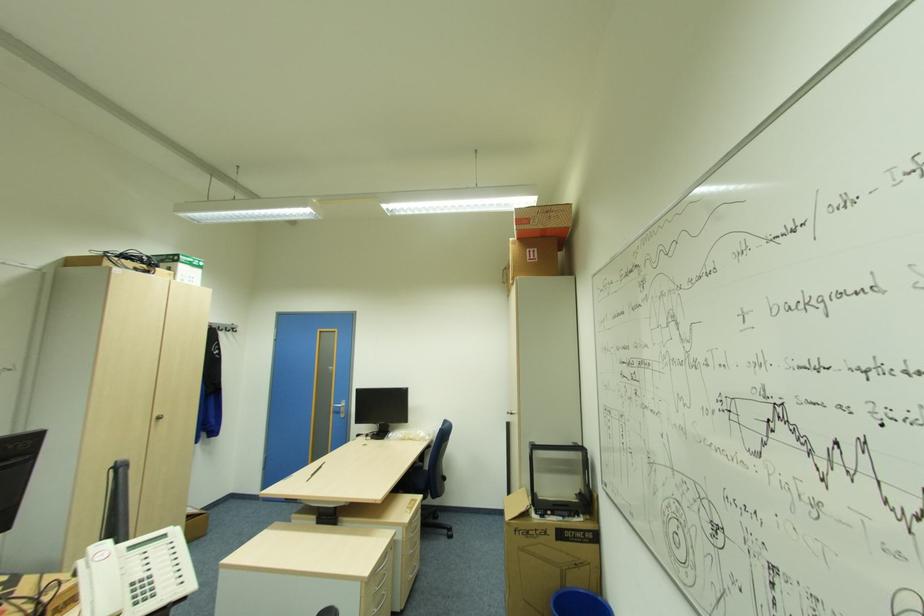
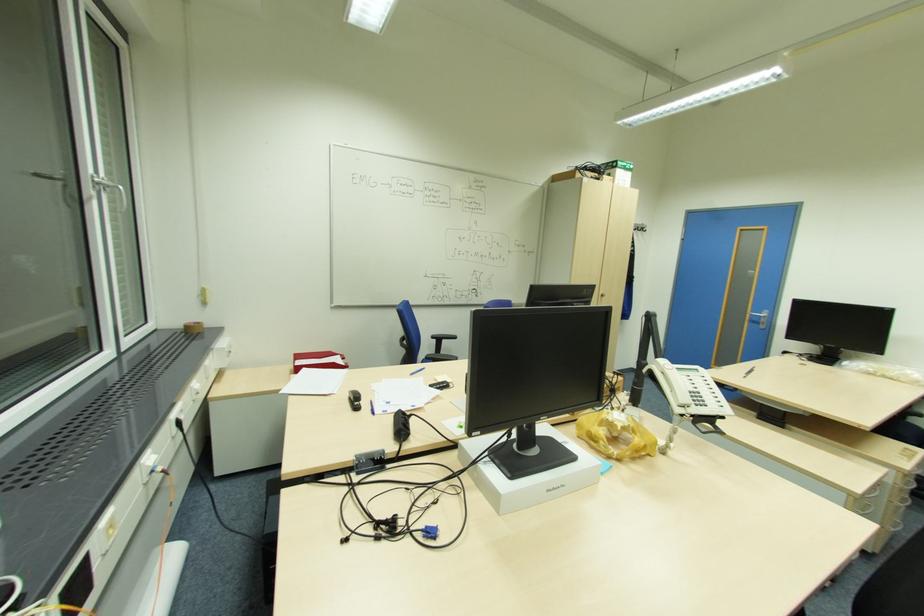
Where in the second image is the point corresponding to point 345,411 from the first image?

(766, 323)